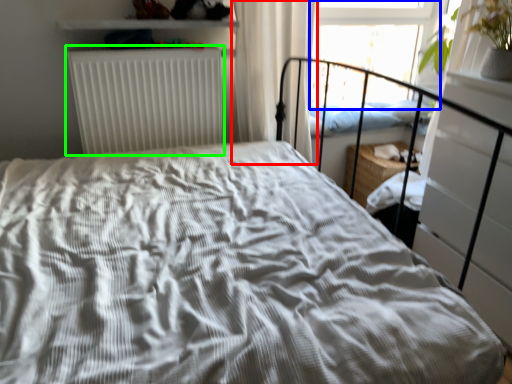
Question: Which object is positioned closest to curtain (highlighted by a red box)? Select from window screen (highlighted by a blue box) and radiator (highlighted by a green box).

Choices:
 (A) window screen
 (B) radiator

Answer: (B)